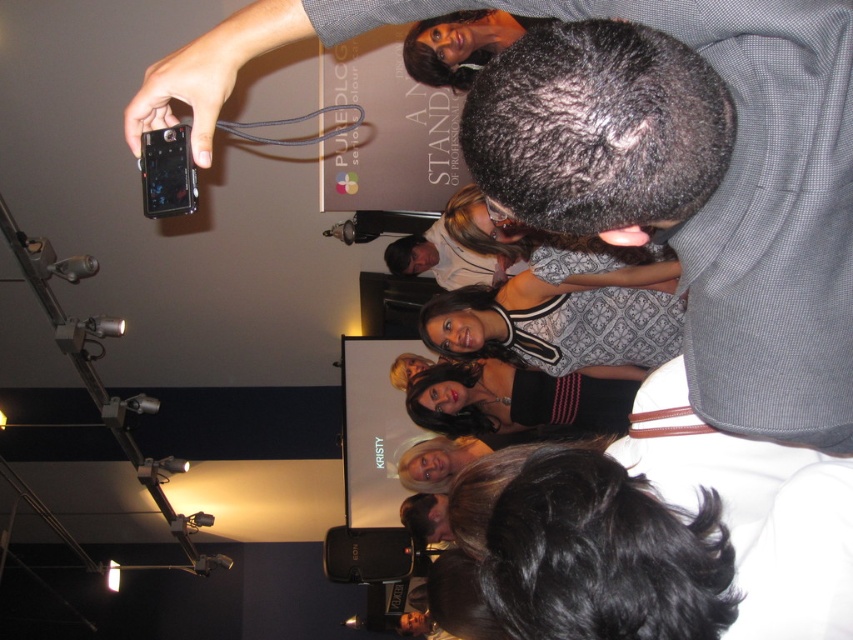
Question: Does gray textured shirt at upper right have a lesser width compared to matte black smartphone at upper left?

Choices:
 (A) no
 (B) yes

Answer: (A)

Question: Is gray textured shirt at upper right to the left of matte black smartphone at upper left from the viewer's perspective?

Choices:
 (A) no
 (B) yes

Answer: (A)

Question: In this image, where is gray textured shirt at upper right located relative to matte black smartphone at upper left?

Choices:
 (A) right
 (B) left

Answer: (A)

Question: Which point is farther to the camera?

Choices:
 (A) (747, 364)
 (B) (177, 156)

Answer: (B)

Question: Which point appears farthest from the camera in this image?

Choices:
 (A) (172, 188)
 (B) (819, 8)

Answer: (A)

Question: Which point is farther to the camera?

Choices:
 (A) pos(614,180)
 (B) pos(161,180)

Answer: (B)